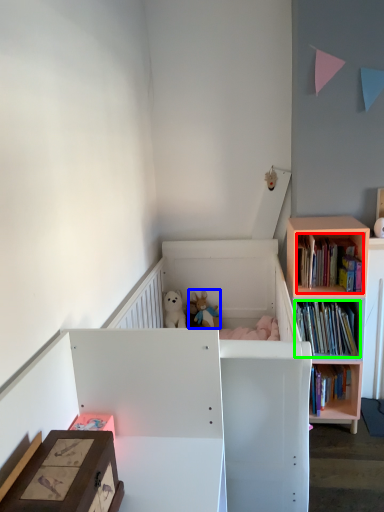
Question: Which object is positioned closest to book (highlighted by a red box)? Select from toy (highlighted by a blue box) and book (highlighted by a green box).

Choices:
 (A) toy
 (B) book

Answer: (B)